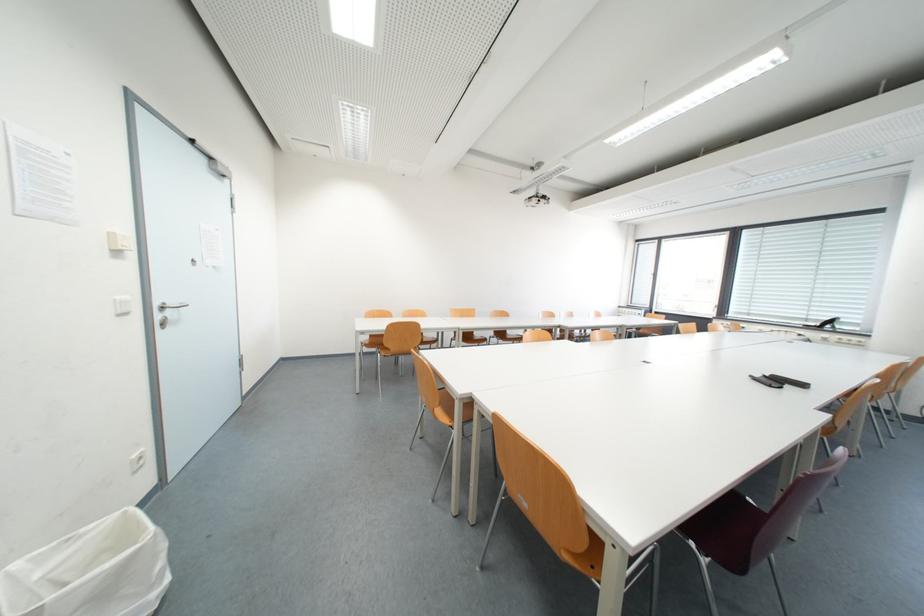
Find where to press the rectangular wall switch. Please return your answer as a coordinate pair (x, y).

(118, 241)